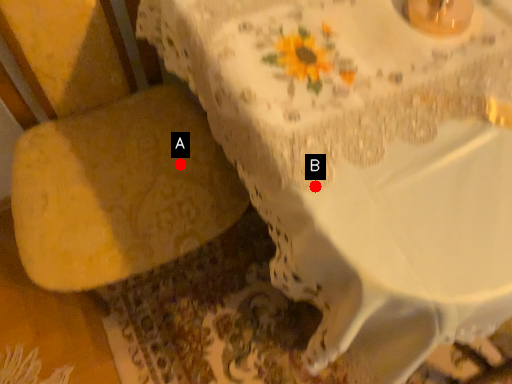
Question: Two points are circled on the image, labeled by A and B beside each circle. Which point appears farthest from the camera in this image?

Choices:
 (A) A is further
 (B) B is further

Answer: (A)